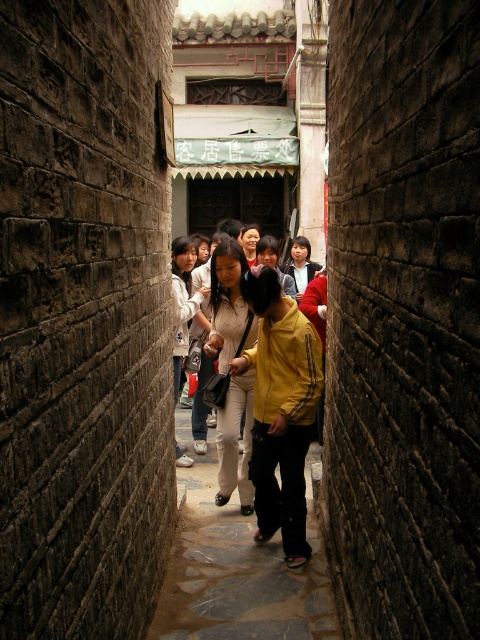
Is the position of stone paved path at center more distant than that of matte white pants at center?

No, stone paved path at center is closer to the viewer.

Who is higher up, stone paved path at center or matte white pants at center?

matte white pants at center

Identify the location of stone paved path at center. (237, 573).

At what (x,y) coordinates should I click in order to perform the action: click on stone paved path at center. Please return your answer as a coordinate pair (x, y). The image size is (480, 640). Looking at the image, I should click on (237, 573).